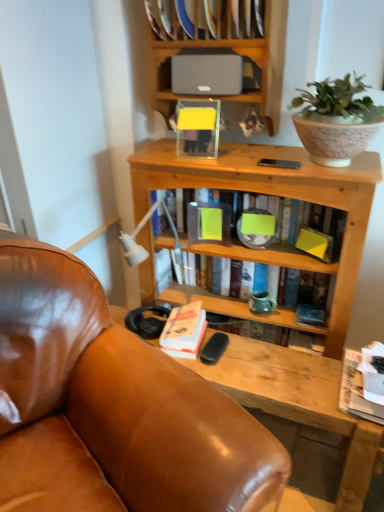
Question: Is satin gray speaker at upper center wider than brown leather chair at center?

Choices:
 (A) no
 (B) yes

Answer: (A)

Question: Does satin gray speaker at upper center appear on the left side of brown leather chair at center?

Choices:
 (A) yes
 (B) no

Answer: (B)

Question: Considering the relative sizes of satin gray speaker at upper center and brown leather chair at center in the image provided, is satin gray speaker at upper center bigger than brown leather chair at center?

Choices:
 (A) no
 (B) yes

Answer: (A)

Question: Are satin gray speaker at upper center and brown leather chair at center making contact?

Choices:
 (A) yes
 (B) no

Answer: (B)

Question: From a real-world perspective, is satin gray speaker at upper center positioned over brown leather chair at center based on gravity?

Choices:
 (A) no
 (B) yes

Answer: (B)

Question: Considering the relative sizes of satin gray speaker at upper center and brown leather chair at center in the image provided, is satin gray speaker at upper center taller than brown leather chair at center?

Choices:
 (A) yes
 (B) no

Answer: (B)

Question: From the image's perspective, does white paper at lower right, placed as the 4th book when sorted from top to bottom, appear higher than satin gray speaker at upper center?

Choices:
 (A) no
 (B) yes

Answer: (A)

Question: Is satin gray speaker at upper center completely or partially inside white paper at lower right, placed as the 4th book when sorted from top to bottom?

Choices:
 (A) yes
 (B) no

Answer: (B)

Question: Considering the relative sizes of white paper at lower right, placed as the 4th book when sorted from top to bottom, and satin gray speaker at upper center in the image provided, is white paper at lower right, placed as the 4th book when sorted from top to bottom, taller than satin gray speaker at upper center?

Choices:
 (A) yes
 (B) no

Answer: (B)

Question: Is white paper at lower right, the 1th book positioned from the bottom, at the right side of satin gray speaker at upper center?

Choices:
 (A) yes
 (B) no

Answer: (A)

Question: Is white paper at lower right, the 1th book positioned from the bottom, next to satin gray speaker at upper center and touching it?

Choices:
 (A) no
 (B) yes

Answer: (A)

Question: Can you confirm if white paper at lower right, the 1th book positioned from the bottom, is smaller than satin gray speaker at upper center?

Choices:
 (A) yes
 (B) no

Answer: (A)

Question: Is hardcover book at center, acting as the 2th book starting from the top, thinner than matte green book at center, which is the fourth book from bottom to top?

Choices:
 (A) no
 (B) yes

Answer: (B)